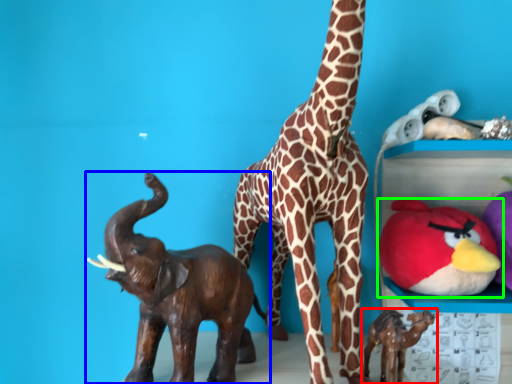
Question: Based on their relative distances, which object is nearer to toy (highlighted by a red box)? Choose from toy (highlighted by a blue box) and toy (highlighted by a green box).

Choices:
 (A) toy
 (B) toy

Answer: (B)